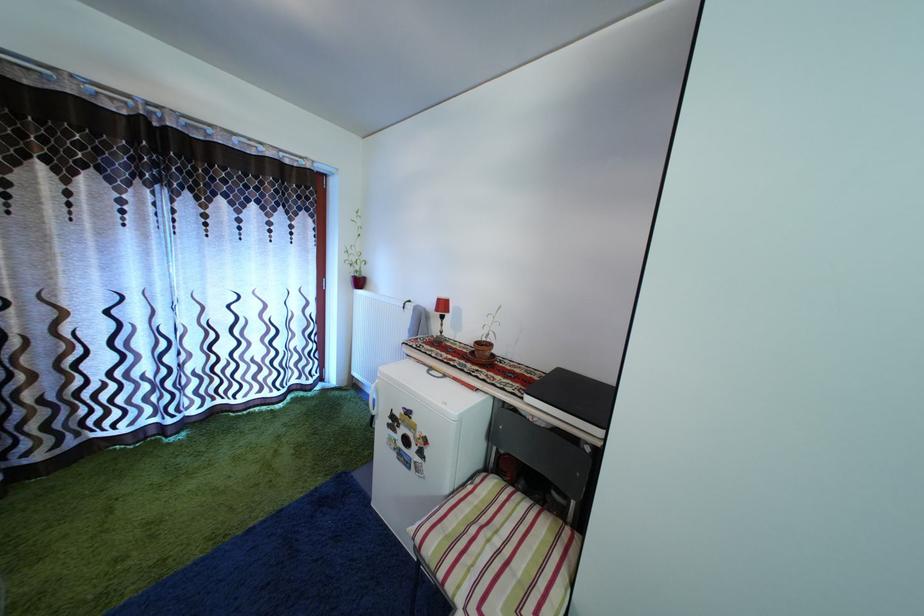
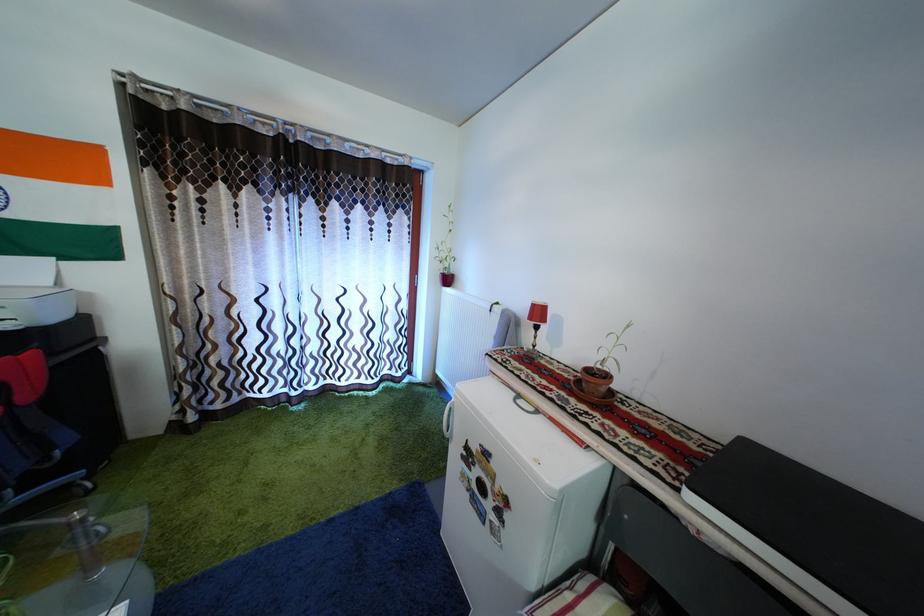
Question: In a continuous first-person perspective shot, in which direction is the camera moving?

Choices:
 (A) Left
 (B) Right
 (C) Forward
 (D) Backward

Answer: (C)